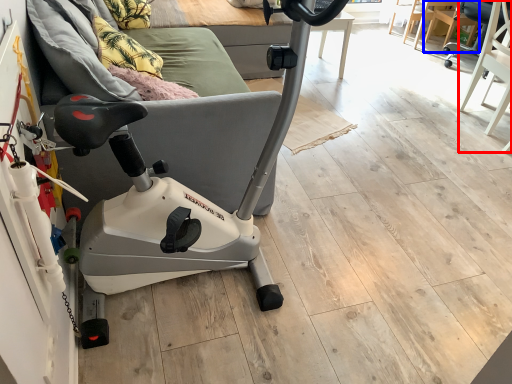
Question: Among these objects, which one is nearest to the camera, swivel chair (highlighted by a red box) or chair (highlighted by a blue box)?

Choices:
 (A) swivel chair
 (B) chair

Answer: (A)